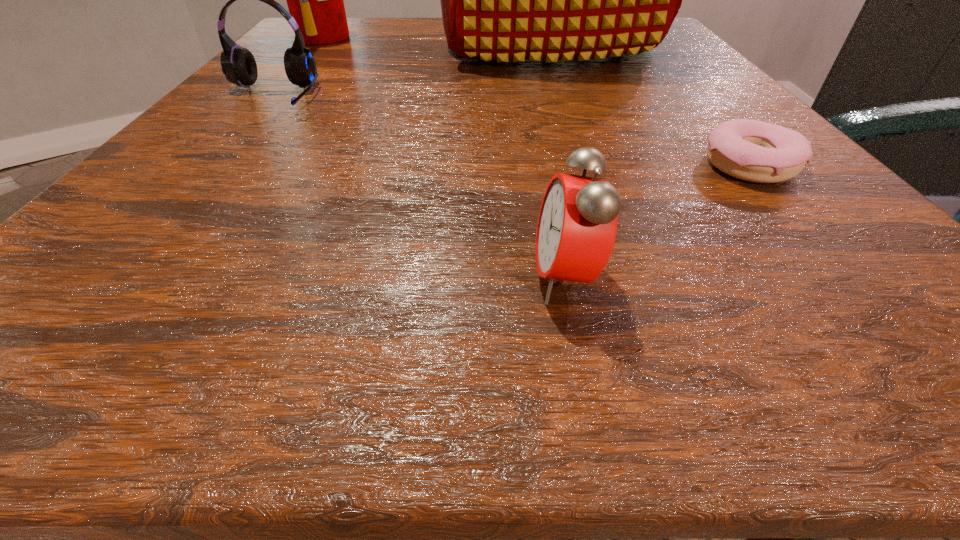
Find the location of `empty space between the headset and the doughnut`. empty space between the headset and the doughnut is located at coordinates (509, 131).

Identify the location of free point between the fourth tallest object and the fire extinguisher. (444, 158).

The image size is (960, 540). Identify the location of free point between the fire extinguisher and the fourth farthest object. (536, 102).

At what (x,y) coordinates should I click in order to perform the action: click on free space between the doughnut and the backpack. Please return your answer as a coordinate pair (x, y). Looking at the image, I should click on (647, 107).

The width and height of the screenshot is (960, 540). I want to click on free area in between the doughnut and the backpack, so click(x=647, y=107).

This screenshot has width=960, height=540. Find the location of `empty space that is in between the second shortest object and the fire extinguisher`. empty space that is in between the second shortest object and the fire extinguisher is located at coordinates (444, 158).

Where is `the fourth closest object to the headset`? The width and height of the screenshot is (960, 540). the fourth closest object to the headset is located at coordinates (751, 150).

Identify which object is the third nearest to the headset. Please provide its 2D coordinates. Your answer should be formatted as a tuple, i.e. [(x, y)], where the tuple contains the x and y coordinates of a point satisfying the conditions above.

[(577, 225)]

Find the location of a particular element. The image size is (960, 540). vacant region that satisfies the following two spatial constraints: 1. on the ear cushions of the shortest object; 2. on the right side of the third nearest object is located at coordinates (211, 166).

The image size is (960, 540). In order to click on free space that satisfies the following two spatial constraints: 1. on the side of the fire extinguisher near the handle; 2. on the ear cushions of the third nearest object in this screenshot , I will do `click(274, 97)`.